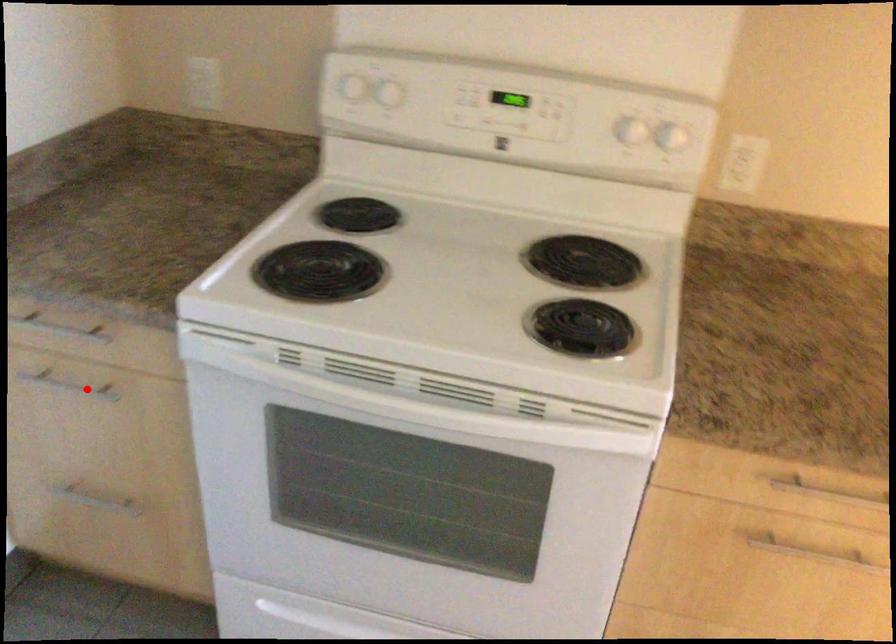
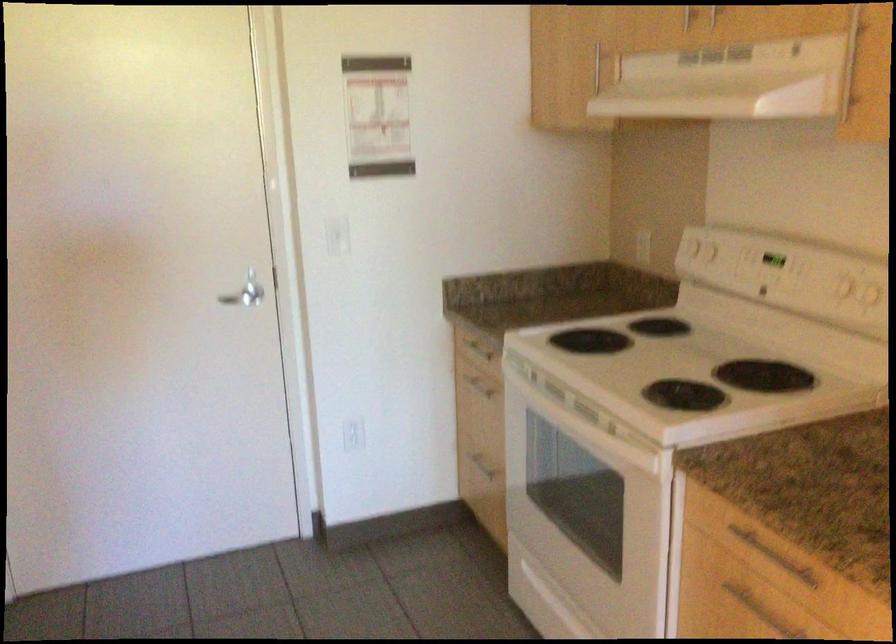
Locate, in the second image, the point that corresponds to the highlighted location in the first image.

(479, 384)